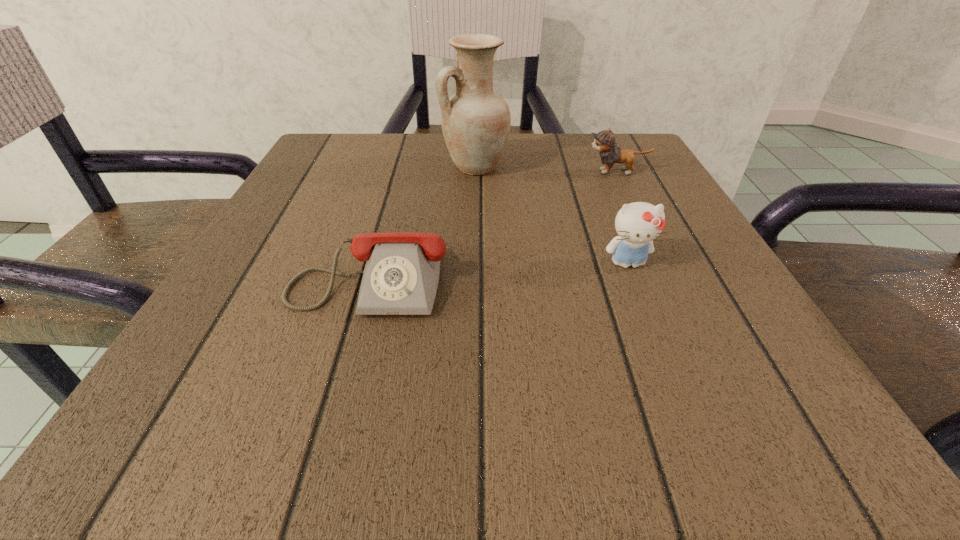
Locate an element on the screen. vacant area that lies between the tallest object and the telephone is located at coordinates (423, 220).

Where is `object that is the nearest to the telephone`? object that is the nearest to the telephone is located at coordinates (475, 121).

Point out which object is positioned as the nearest to the taller kitten. Please provide its 2D coordinates. Your answer should be formatted as a tuple, i.e. [(x, y)], where the tuple contains the x and y coordinates of a point satisfying the conditions above.

[(401, 275)]

The image size is (960, 540). Find the location of `vacant space that satisfies the following two spatial constraints: 1. on the front-facing side of the shorter kitten; 2. on the front-facing side of the taller kitten`. vacant space that satisfies the following two spatial constraints: 1. on the front-facing side of the shorter kitten; 2. on the front-facing side of the taller kitten is located at coordinates (661, 263).

Find the location of a particular element. This screenshot has width=960, height=540. free location that satisfies the following two spatial constraints: 1. on the front-facing side of the third tallest object; 2. on the dial of the telephone is located at coordinates (666, 273).

This screenshot has width=960, height=540. Identify the location of free point that satisfies the following two spatial constraints: 1. on the front-facing side of the shorter kitten; 2. on the dial of the telephone. (666, 273).

Where is `free space that satisfies the following two spatial constraints: 1. on the front-facing side of the third tallest object; 2. on the front-facing side of the nearer kitten`? free space that satisfies the following two spatial constraints: 1. on the front-facing side of the third tallest object; 2. on the front-facing side of the nearer kitten is located at coordinates (661, 263).

The width and height of the screenshot is (960, 540). Identify the location of vacant region that satisfies the following two spatial constraints: 1. on the front-facing side of the shorter kitten; 2. on the dial of the shortest object. (666, 273).

This screenshot has height=540, width=960. What are the coordinates of `free space that satisfies the following two spatial constraints: 1. on the front-facing side of the shorter kitten; 2. on the front-facing side of the second tallest object` in the screenshot? It's located at (661, 263).